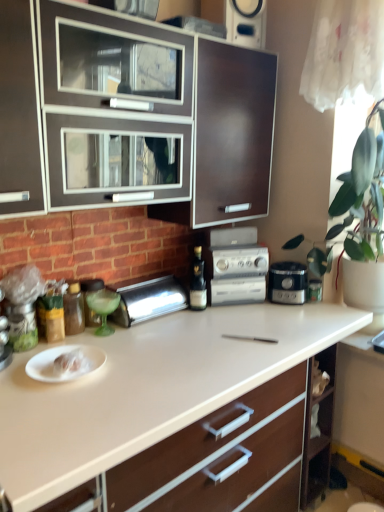
Question: Is satin black coffee maker at center positioned behind silver metallic stereo at center?

Choices:
 (A) no
 (B) yes

Answer: (B)

Question: Is satin black coffee maker at center at the right side of silver metallic stereo at center?

Choices:
 (A) no
 (B) yes

Answer: (B)

Question: Considering the relative sizes of satin black coffee maker at center and silver metallic stereo at center in the image provided, is satin black coffee maker at center wider than silver metallic stereo at center?

Choices:
 (A) no
 (B) yes

Answer: (A)

Question: From a real-world perspective, is satin black coffee maker at center physically below silver metallic stereo at center?

Choices:
 (A) no
 (B) yes

Answer: (B)

Question: Would you say satin black coffee maker at center is outside silver metallic stereo at center?

Choices:
 (A) no
 (B) yes

Answer: (B)

Question: In terms of height, does metallic silver spice container at left, arranged as the 1th appliance when viewed from the left, look taller or shorter compared to black glass bottle at center, which ranks as the 2th bottle in left-to-right order?

Choices:
 (A) tall
 (B) short

Answer: (B)

Question: From a real-world perspective, is metallic silver spice container at left, the 2th appliance viewed from the back, physically located above or below black glass bottle at center, which ranks as the 2th bottle in left-to-right order?

Choices:
 (A) below
 (B) above

Answer: (A)

Question: Looking at their shapes, would you say metallic silver spice container at left, which ranks as the second appliance in right-to-left order, is wider or thinner than black glass bottle at center, which is the first bottle in right-to-left order?

Choices:
 (A) wide
 (B) thin

Answer: (A)

Question: From the image's perspective, is metallic silver spice container at left, which ranks as the second appliance in right-to-left order, above or below black glass bottle at center, which is the first bottle from back to front?

Choices:
 (A) above
 (B) below

Answer: (B)

Question: Considering the relative positions of black glass bottle at center, which is the first bottle in right-to-left order, and brown glass bottle at left, placed as the 2th bottle when sorted from right to left, in the image provided, is black glass bottle at center, which is the first bottle in right-to-left order, to the left or to the right of brown glass bottle at left, placed as the 2th bottle when sorted from right to left,?

Choices:
 (A) right
 (B) left

Answer: (A)

Question: In terms of size, does black glass bottle at center, which is the first bottle from back to front, appear bigger or smaller than brown glass bottle at left, placed as the 2th bottle when sorted from right to left?

Choices:
 (A) small
 (B) big

Answer: (A)

Question: Looking at their shapes, would you say black glass bottle at center, which is the first bottle from back to front, is wider or thinner than brown glass bottle at left, placed as the second bottle when sorted from back to front?

Choices:
 (A) thin
 (B) wide

Answer: (A)

Question: From the image's perspective, is black glass bottle at center, which is the first bottle from back to front, located above or below brown glass bottle at left, the first bottle in the left-to-right sequence?

Choices:
 (A) above
 (B) below

Answer: (A)

Question: In the image, is black glass bottle at center, the second bottle in the front-to-back sequence, positioned in front of or behind matte brown cabinet at upper center?

Choices:
 (A) front
 (B) behind

Answer: (B)

Question: Would you say black glass bottle at center, which ranks as the 2th bottle in left-to-right order, is to the left or to the right of matte brown cabinet at upper center in the picture?

Choices:
 (A) right
 (B) left

Answer: (A)